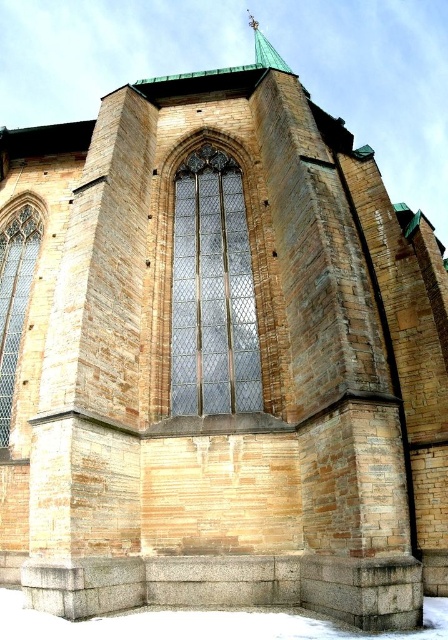
Question: Which point is farther to the camera?

Choices:
 (A) (266, 40)
 (B) (241, 636)
 (C) (245, 243)
 (D) (16, 221)

Answer: (A)

Question: Is clear glass window at center above white powdery snow at lower center?

Choices:
 (A) yes
 (B) no

Answer: (A)

Question: Can you confirm if white powdery snow at lower center is wider than green copper spire at upper center?

Choices:
 (A) yes
 (B) no

Answer: (A)

Question: Estimate the real-world distances between objects in this image. Which object is closer to the clear glass window at center?

Choices:
 (A) clear glass window at left
 (B) white powdery snow at lower center

Answer: (A)

Question: Which of the following is the closest to the observer?

Choices:
 (A) clear glass window at left
 (B) white powdery snow at lower center
 (C) green copper spire at upper center
 (D) clear glass window at center

Answer: (B)

Question: In this image, where is clear glass window at left located relative to green copper spire at upper center?

Choices:
 (A) above
 (B) below

Answer: (B)